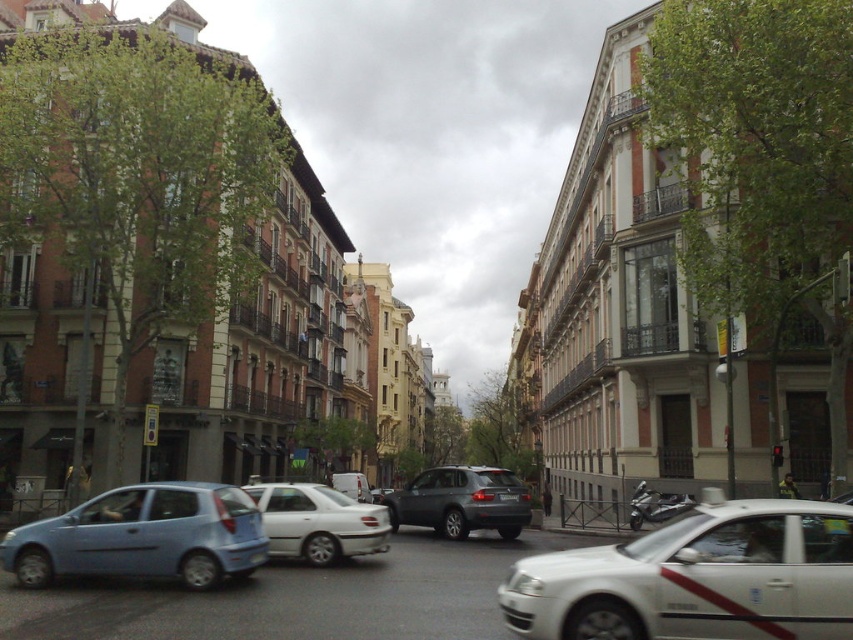
Who is more forward, (704, 609) or (317, 564)?

Point (704, 609)

Which is more to the right, white matte taxi at center or white matte sedan at center?

white matte taxi at center is more to the right.

Is point (645, 544) less distant than point (352, 499)?

Yes, it is.

The height and width of the screenshot is (640, 853). What are the coordinates of `white matte taxi at center` in the screenshot? It's located at (697, 579).

Is metallic gray suv at center positioned at the back of white matte van at center?

No, it is not.

Is metallic gray suv at center wider than white matte van at center?

Indeed, metallic gray suv at center has a greater width compared to white matte van at center.

Find the location of a particular element. This screenshot has height=640, width=853. metallic gray suv at center is located at coordinates (x=461, y=500).

Can you confirm if white matte taxi at center is shorter than metallic gray suv at center?

No.

Who is lower down, white matte taxi at center or metallic gray suv at center?

metallic gray suv at center

Where is `white matte taxi at center`? white matte taxi at center is located at coordinates (697, 579).